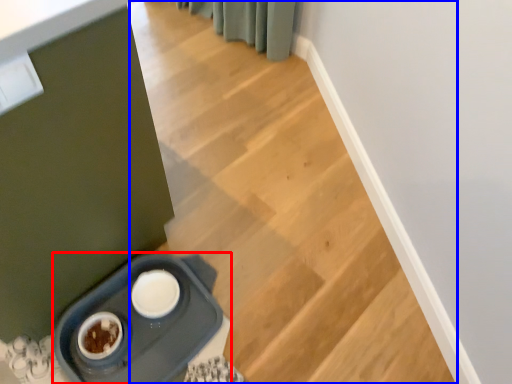
Question: Which point is closer to the camera, appliance (highlighted by a red box) or stairs (highlighted by a blue box)?

Choices:
 (A) appliance
 (B) stairs

Answer: (B)